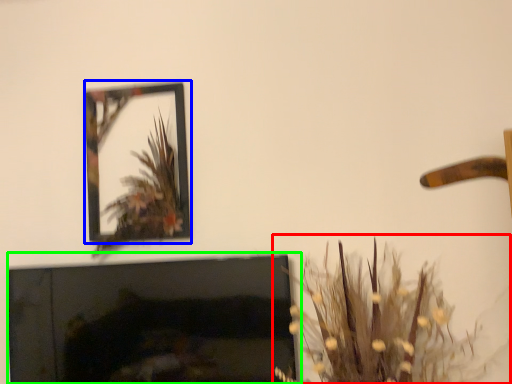
Question: Considering the real-world distances, which object is closest to houseplant (highlighted by a red box)? picture frame (highlighted by a blue box) or fireplace (highlighted by a green box).

Choices:
 (A) picture frame
 (B) fireplace

Answer: (B)